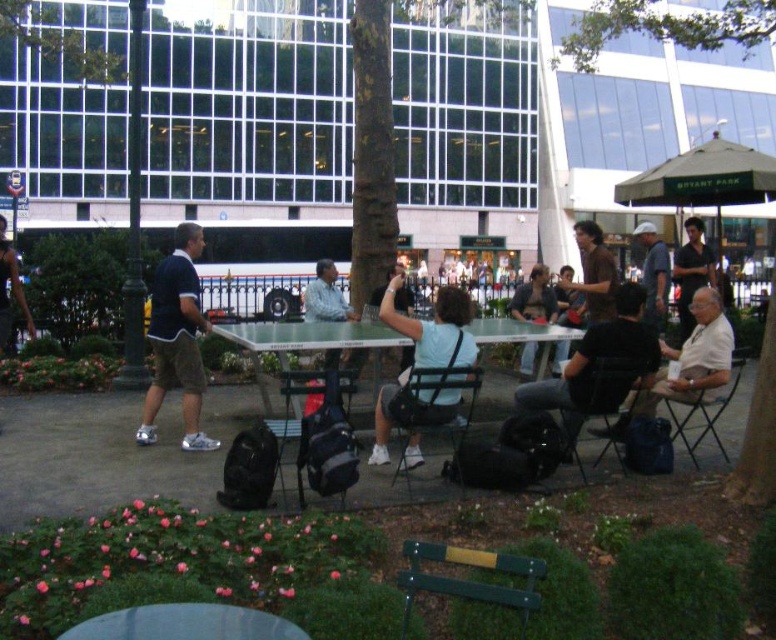
Question: Estimate the real-world distances between objects in this image. Which object is closer to the dark brown leather jacket at center?

Choices:
 (A) matte blue shirt at left
 (B) dark brown hair at upper right
 (C) blue fabric shorts at left
 (D) black fabric chair at center

Answer: (B)

Question: Does black fabric shirt at center lie in front of green plastic bench at lower center?

Choices:
 (A) yes
 (B) no

Answer: (B)

Question: Considering the relative positions of light blue shirt at center and light brown leather jacket at center in the image provided, where is light blue shirt at center located with respect to light brown leather jacket at center?

Choices:
 (A) right
 (B) left

Answer: (B)

Question: Does brown matte shirt at center appear on the left side of metallic silver chair at center?

Choices:
 (A) no
 (B) yes

Answer: (A)

Question: Which point is farther to the camera?

Choices:
 (A) light blue fabric shirt at center
 (B) black fabric chair at lower right

Answer: (B)

Question: Considering the real-world distances, which object is farthest from the light brown leather jacket at center?

Choices:
 (A) black fabric chair at center
 (B) clear plastic picnic table at center

Answer: (A)